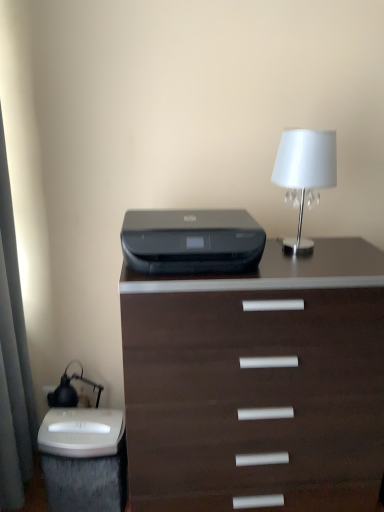
Question: In terms of height, does white glossy lampshade at upper right look taller or shorter compared to white plastic electric outlet at lower left?

Choices:
 (A) short
 (B) tall

Answer: (B)

Question: Is white glossy lampshade at upper right in front of or behind white plastic electric outlet at lower left in the image?

Choices:
 (A) front
 (B) behind

Answer: (A)

Question: Based on their relative distances, which object is nearer to the dark wood chest of drawers at center?

Choices:
 (A) white glossy lampshade at upper right
 (B) white plastic electric outlet at lower left
 (C) black plastic printer at center

Answer: (C)

Question: Based on their relative distances, which object is nearer to the black plastic printer at center?

Choices:
 (A) white plastic electric outlet at lower left
 (B) white glossy lampshade at upper right
 (C) dark wood chest of drawers at center

Answer: (C)